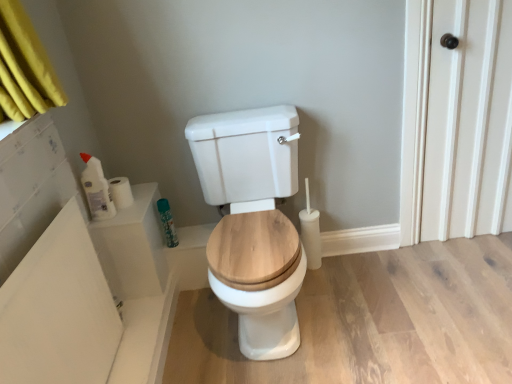
Question: Is white glossy bottle at left, which is counted as the 1th toiletry, starting from the front, further to camera compared to white glossy toilet at center?

Choices:
 (A) yes
 (B) no

Answer: (A)

Question: Is white glossy bottle at left, the 2th toiletry from the back, far away from white glossy toilet at center?

Choices:
 (A) yes
 (B) no

Answer: (B)

Question: Can you confirm if white glossy bottle at left, the 2th toiletry from the back, is shorter than white glossy toilet at center?

Choices:
 (A) no
 (B) yes

Answer: (B)

Question: Is white glossy bottle at left, the 2th toiletry from the back, bigger than white glossy toilet at center?

Choices:
 (A) no
 (B) yes

Answer: (A)

Question: Is white glossy bottle at left, the 2th toiletry from the back, wider than white glossy toilet at center?

Choices:
 (A) no
 (B) yes

Answer: (A)

Question: Is white glossy bottle at left, the second toiletry in the right-to-left sequence, smaller than white glossy toilet at center?

Choices:
 (A) no
 (B) yes

Answer: (B)

Question: Can white glossy bottle at left, the second toiletry in the right-to-left sequence, be found inside white glossy toilet at center?

Choices:
 (A) no
 (B) yes

Answer: (A)

Question: From a real-world perspective, is white glossy toilet at center physically above white glossy bottle at left, the second toiletry in the right-to-left sequence?

Choices:
 (A) yes
 (B) no

Answer: (B)

Question: Considering the relative positions of white glossy toilet at center and white glossy bottle at left, the 2th toiletry from the back, in the image provided, is white glossy toilet at center behind white glossy bottle at left, the 2th toiletry from the back,?

Choices:
 (A) yes
 (B) no

Answer: (B)

Question: Does white glossy toilet at center have a larger size compared to white glossy bottle at left, which is counted as the 1th toiletry, starting from the front?

Choices:
 (A) no
 (B) yes

Answer: (B)

Question: Does white glossy toilet at center have a smaller size compared to white glossy bottle at left, which is counted as the 1th toiletry, starting from the front?

Choices:
 (A) no
 (B) yes

Answer: (A)

Question: Is white glossy toilet at center facing away from white glossy bottle at left, the second toiletry in the right-to-left sequence?

Choices:
 (A) no
 (B) yes

Answer: (A)

Question: Is white glossy toilet at center positioned beyond the bounds of green matte spray can at upper left, which is counted as the first toiletry, starting from the back?

Choices:
 (A) no
 (B) yes

Answer: (B)